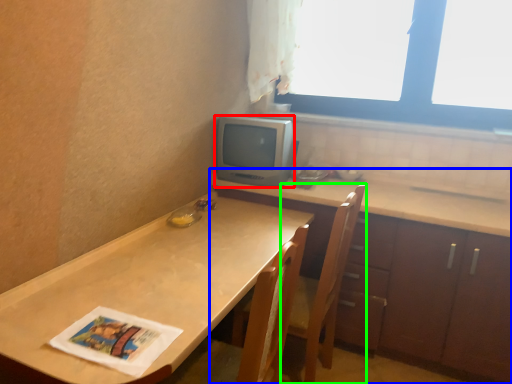
Question: Considering the real-world distances, which object is closest to appliance (highlighted by a red box)? cabinetry (highlighted by a blue box) or chair (highlighted by a green box).

Choices:
 (A) cabinetry
 (B) chair

Answer: (A)